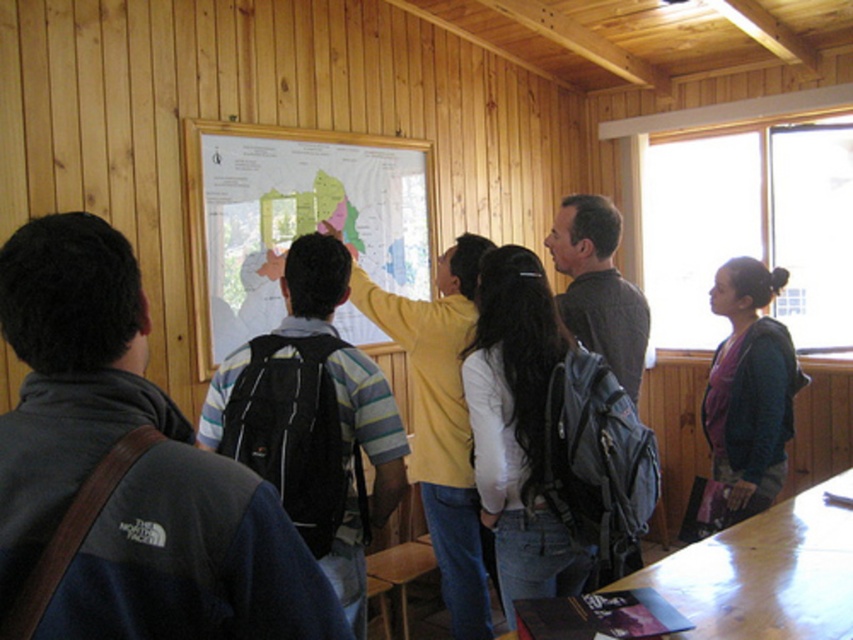
Question: Is white matte map at center to the right of purple fleece jacket at right from the viewer's perspective?

Choices:
 (A) yes
 (B) no

Answer: (B)

Question: Which point is farther to the camera?

Choices:
 (A) (465, 616)
 (B) (352, 170)
 (C) (764, 496)

Answer: (B)

Question: Considering the real-world distances, which object is closest to the white matte map at center?

Choices:
 (A) yellow matte shirt at center
 (B) purple fleece jacket at right

Answer: (A)

Question: From the image, what is the correct spatial relationship of white matte map at center in relation to yellow matte shirt at center?

Choices:
 (A) above
 (B) below

Answer: (A)

Question: Which object appears closest to the camera in this image?

Choices:
 (A) purple fleece jacket at right
 (B) white matte map at center

Answer: (A)

Question: Is yellow matte shirt at center positioned before purple fleece jacket at right?

Choices:
 (A) yes
 (B) no

Answer: (A)